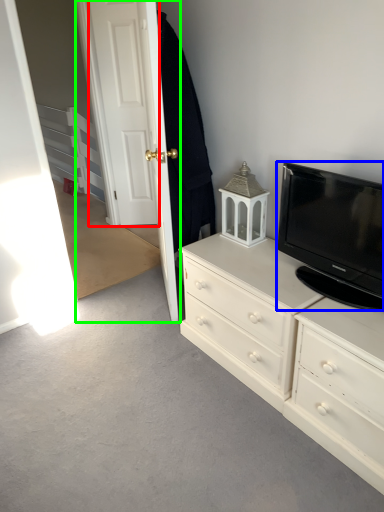
Question: Based on their relative distances, which object is farther from door (highlighted by a red box)? Choose from television (highlighted by a blue box) and door (highlighted by a green box).

Choices:
 (A) television
 (B) door

Answer: (A)